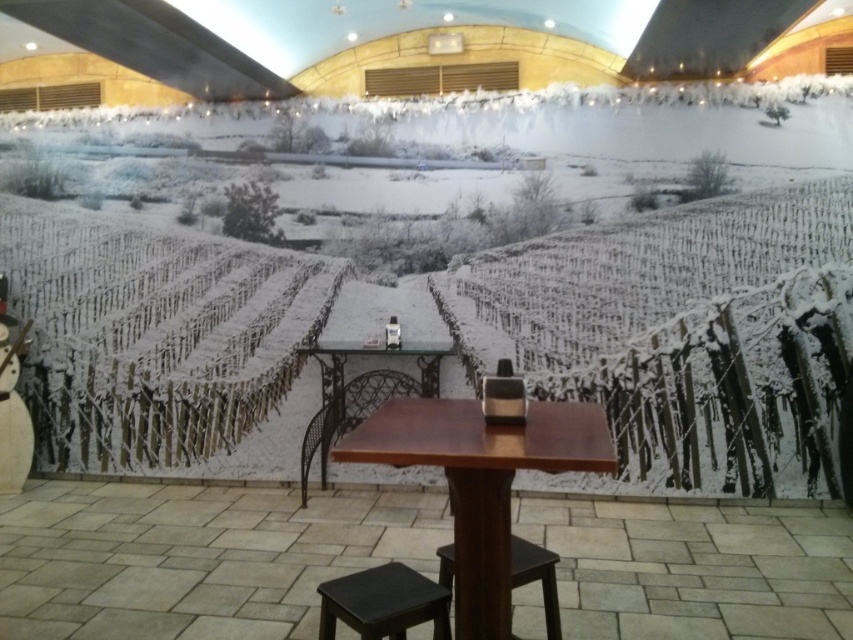
Question: Is wooden table at center positioned before metallic brown chair at center?

Choices:
 (A) no
 (B) yes

Answer: (B)

Question: Can you confirm if wooden table at center is smaller than metallic brown chair at center?

Choices:
 (A) no
 (B) yes

Answer: (A)

Question: Estimate the real-world distances between objects in this image. Which object is farther from the dark brown wooden stool at center?

Choices:
 (A) metallic brown chair at center
 (B) wooden table at center

Answer: (A)

Question: Estimate the real-world distances between objects in this image. Which object is farther from the wooden table at center?

Choices:
 (A) dark brown wooden stool at lower center
 (B) metallic brown chair at center

Answer: (B)

Question: Is dark brown wooden stool at lower center to the right of metallic brown chair at center from the viewer's perspective?

Choices:
 (A) yes
 (B) no

Answer: (A)

Question: Which object appears farthest from the camera in this image?

Choices:
 (A) metallic brown chair at center
 (B) dark brown wooden stool at center
 (C) wooden table at center

Answer: (A)